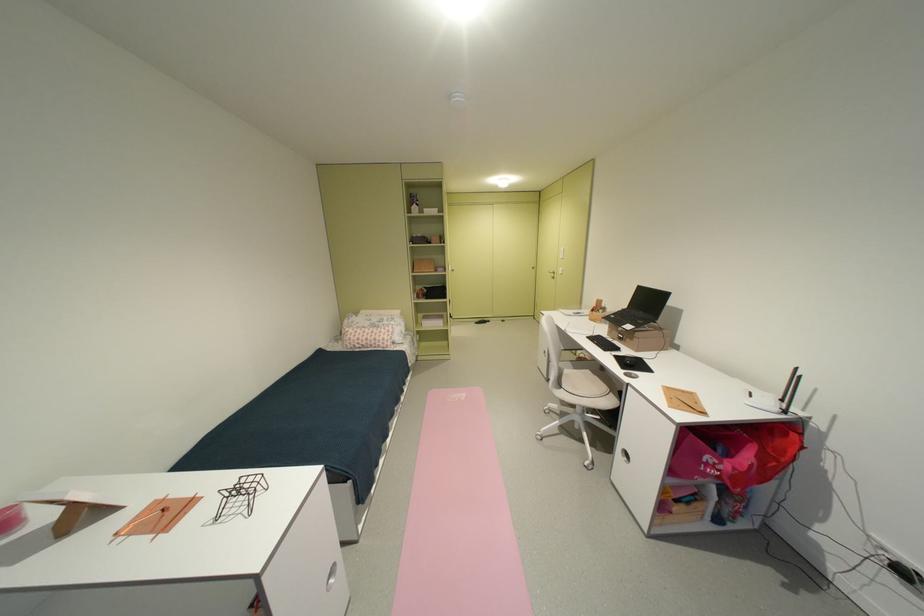
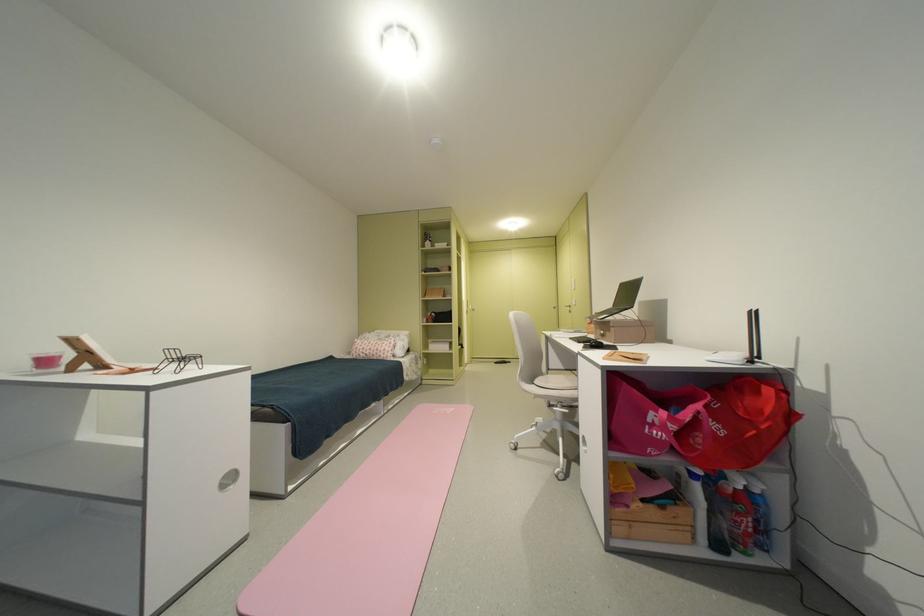
Locate, in the second image, the point that corresponds to the point at 641,341 in the first image.

(618, 331)